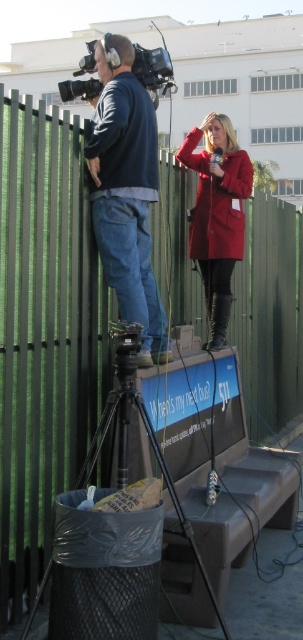
You are a photographer trying to set up a camera on a tripod. You have the black plastic tripod at lower center and the blue denim jeans at center in your view. If you want to ensure the tripod is stable, which object should you place the tripod on?

The black plastic tripod at lower center has a larger width than the blue denim jeans at center, so placing it on the tripod itself would provide better stability. However, since the tripod is the object in question, you should ensure it is placed on a solid surface like the ground to maintain stability.

You are a pedestrian who wants to walk from the trash can to the bench. The path is blocked by the black plastic tripod at lower center and the matte red coat at center. Which object do you need to go around first?

The black plastic tripod at lower center is in front of the matte red coat at center, so you need to go around the black plastic tripod at lower center first.

Based on the photo, you are a passerby who wants to know which item is higher between the blue denim jeans at center and the matte red coat at center. Based on the scene, which one is taller?

The blue denim jeans at center is much taller than the matte red coat at center according to the description.